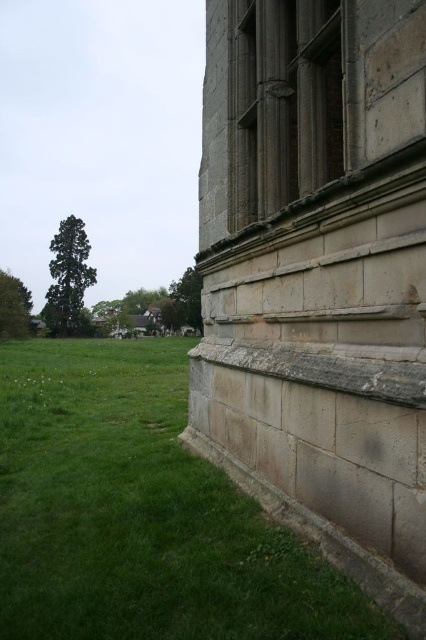
Question: Can you confirm if green grass at lower left is positioned to the right of dark gray stone window at upper right?

Choices:
 (A) no
 (B) yes

Answer: (A)

Question: Is green grass at lower left thinner than dark gray stone window at upper right?

Choices:
 (A) yes
 (B) no

Answer: (B)

Question: Which of the following is the closest to the observer?

Choices:
 (A) dark gray stone window at upper right
 (B) green grass at lower left

Answer: (B)

Question: Which object is farther from the camera taking this photo?

Choices:
 (A) green grass at lower left
 (B) dark gray stone window at upper right

Answer: (B)

Question: Is green grass at lower left closer to the viewer compared to dark gray stone window at upper right?

Choices:
 (A) yes
 (B) no

Answer: (A)